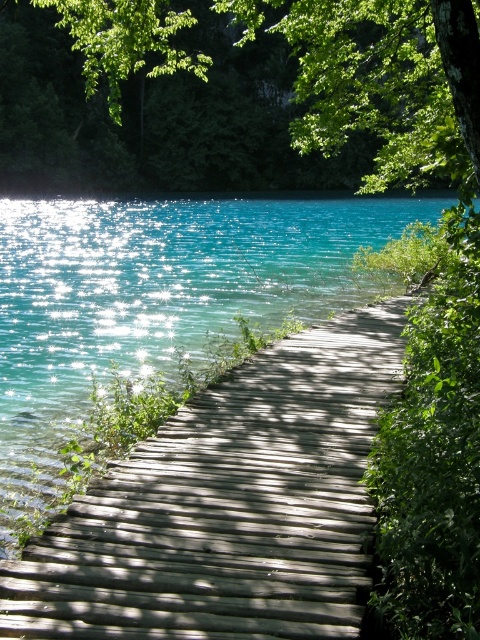
Question: Can you confirm if wooden dock at center is positioned to the right of green leafy tree at upper center?

Choices:
 (A) yes
 (B) no

Answer: (B)

Question: Does wooden dock at center have a greater width compared to green leafy tree at upper center?

Choices:
 (A) no
 (B) yes

Answer: (A)

Question: Among these objects, which one is farthest from the camera?

Choices:
 (A) green leafy tree at upper center
 (B) wooden dock at center

Answer: (A)

Question: Can you confirm if wooden dock at center is wider than green leafy tree at upper center?

Choices:
 (A) yes
 (B) no

Answer: (B)

Question: Which of the following is the closest to the observer?

Choices:
 (A) green leafy tree at upper center
 (B) wooden dock at center

Answer: (B)

Question: Which of the following is the farthest from the observer?

Choices:
 (A) wooden dock at center
 (B) green leafy tree at upper center

Answer: (B)